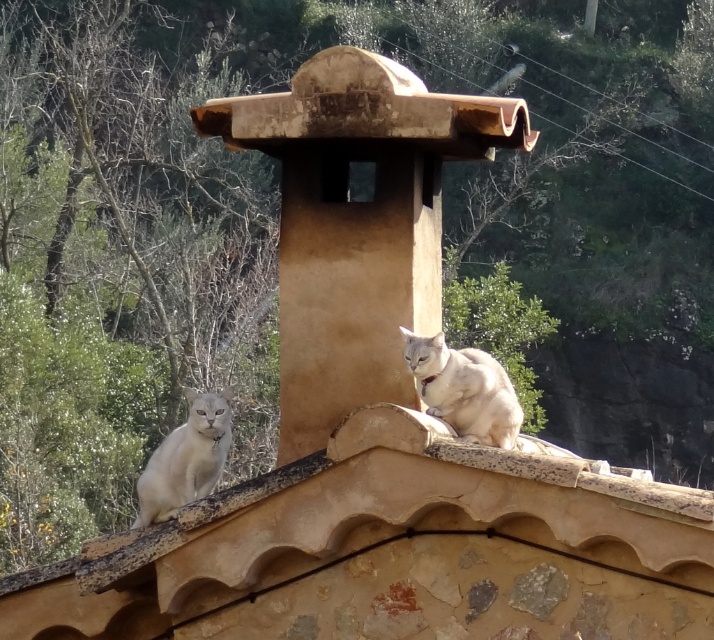
Question: Which is farther from the white fur cat at upper center?

Choices:
 (A) brown textured tile roof at center
 (B) white fur cat at center

Answer: (B)

Question: Which point is closer to the camera?

Choices:
 (A) (144, 477)
 (B) (387, 506)

Answer: (B)

Question: Which point is farther to the camera?

Choices:
 (A) tap(223, 605)
 (B) tap(431, 339)
 (C) tap(146, 513)

Answer: (C)

Question: Does brown textured tile roof at center appear under white fur cat at center?

Choices:
 (A) yes
 (B) no

Answer: (B)

Question: From the image, what is the correct spatial relationship of white fur cat at upper center in relation to white fur cat at center?

Choices:
 (A) above
 (B) below

Answer: (A)

Question: Where is brown textured tile roof at center located in relation to white fur cat at center in the image?

Choices:
 (A) right
 (B) left

Answer: (A)